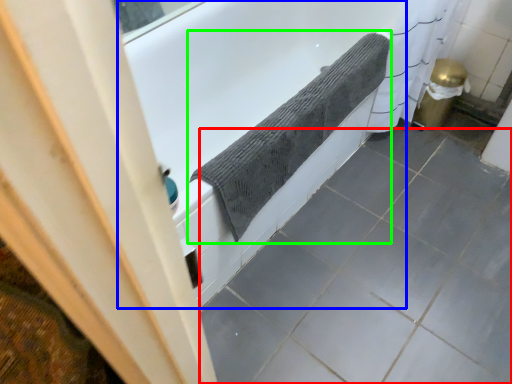
Question: Considering the real-world distances, which object is farthest from ceramic tile (highlighted by a red box)? bathtub (highlighted by a blue box) or bath towel (highlighted by a green box)?

Choices:
 (A) bathtub
 (B) bath towel

Answer: (A)